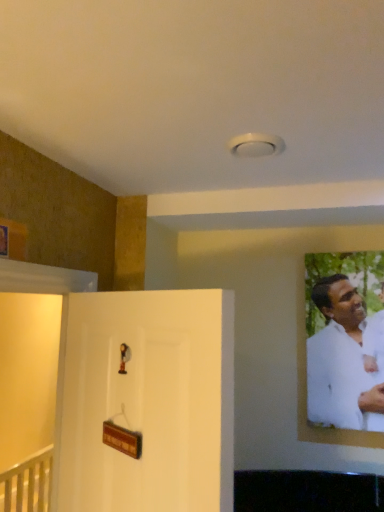
Question: Is the position of white matte shirt at right less distant than that of white matte door at left?

Choices:
 (A) no
 (B) yes

Answer: (A)

Question: Considering the relative sizes of white matte shirt at right and white matte door at left in the image provided, is white matte shirt at right smaller than white matte door at left?

Choices:
 (A) yes
 (B) no

Answer: (A)

Question: Can you confirm if white matte shirt at right is thinner than white matte door at left?

Choices:
 (A) no
 (B) yes

Answer: (B)

Question: Is white matte shirt at right further to the viewer compared to white matte door at left?

Choices:
 (A) no
 (B) yes

Answer: (B)

Question: Is white matte shirt at right to the left of white matte door at left from the viewer's perspective?

Choices:
 (A) yes
 (B) no

Answer: (B)

Question: Is white matte shirt at right not inside white matte door at left?

Choices:
 (A) no
 (B) yes

Answer: (B)

Question: Does white matte door at left have a lesser height compared to white matte shirt at right?

Choices:
 (A) no
 (B) yes

Answer: (A)

Question: Is white matte door at left behind white matte shirt at right?

Choices:
 (A) yes
 (B) no

Answer: (B)

Question: Is white matte door at left located outside white matte shirt at right?

Choices:
 (A) yes
 (B) no

Answer: (A)

Question: Could you tell me if white matte door at left is facing white matte shirt at right?

Choices:
 (A) yes
 (B) no

Answer: (B)

Question: From a real-world perspective, is white matte door at left beneath white matte shirt at right?

Choices:
 (A) yes
 (B) no

Answer: (A)

Question: From a real-world perspective, is white matte door at left on white matte shirt at right?

Choices:
 (A) yes
 (B) no

Answer: (B)

Question: Relative to white matte shirt at right, is white matte door at left in front or behind?

Choices:
 (A) front
 (B) behind

Answer: (A)